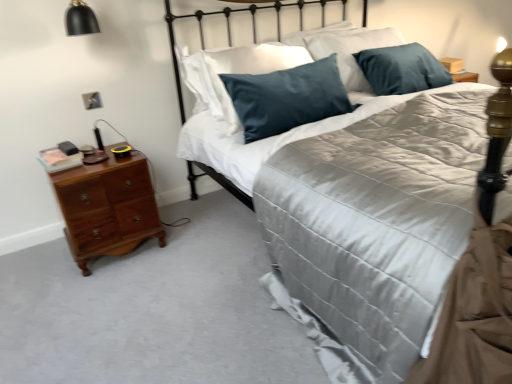
Question: Is cherry wood nightstand at left aimed at black matte lampshade at upper left?

Choices:
 (A) no
 (B) yes

Answer: (A)

Question: Is cherry wood nightstand at left facing away from black matte lampshade at upper left?

Choices:
 (A) no
 (B) yes

Answer: (A)

Question: From a real-world perspective, does cherry wood nightstand at left stand above black matte lampshade at upper left?

Choices:
 (A) no
 (B) yes

Answer: (A)

Question: Is cherry wood nightstand at left bigger than black matte lampshade at upper left?

Choices:
 (A) yes
 (B) no

Answer: (A)

Question: Is cherry wood nightstand at left at the left side of black matte lampshade at upper left?

Choices:
 (A) yes
 (B) no

Answer: (B)

Question: From the image's perspective, would you say cherry wood nightstand at left is shown under black matte lampshade at upper left?

Choices:
 (A) yes
 (B) no

Answer: (A)

Question: Does cherry wood nightstand at left come in front of satin black headboard at upper center?

Choices:
 (A) yes
 (B) no

Answer: (B)

Question: Can satin black headboard at upper center be found inside cherry wood nightstand at left?

Choices:
 (A) no
 (B) yes

Answer: (A)

Question: Is cherry wood nightstand at left far from satin black headboard at upper center?

Choices:
 (A) yes
 (B) no

Answer: (B)

Question: From the image's perspective, is cherry wood nightstand at left on satin black headboard at upper center?

Choices:
 (A) no
 (B) yes

Answer: (A)

Question: Is cherry wood nightstand at left looking in the opposite direction of satin black headboard at upper center?

Choices:
 (A) yes
 (B) no

Answer: (B)

Question: Is cherry wood nightstand at left outside of satin black headboard at upper center?

Choices:
 (A) no
 (B) yes

Answer: (B)

Question: From the image's perspective, is black matte lampshade at upper left over satin black headboard at upper center?

Choices:
 (A) no
 (B) yes

Answer: (B)